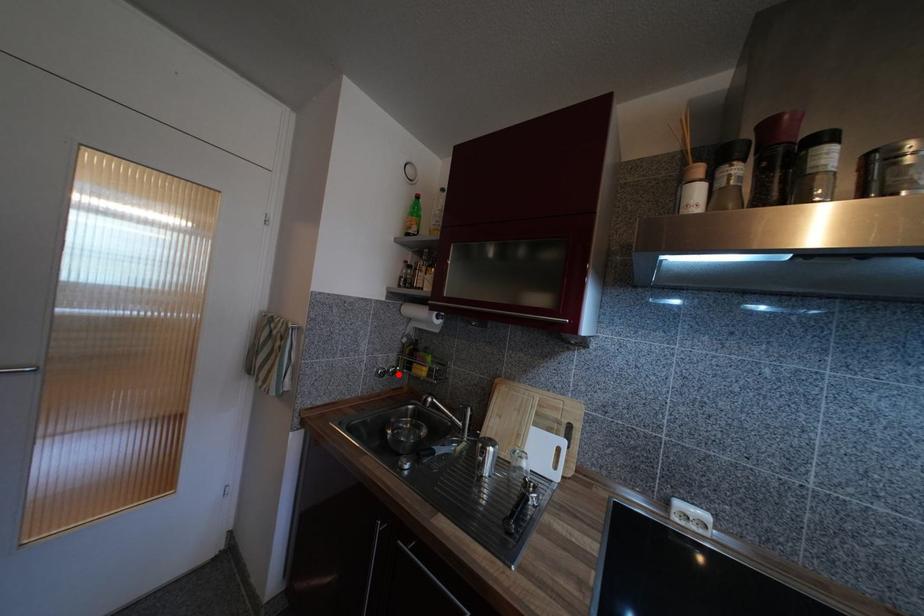
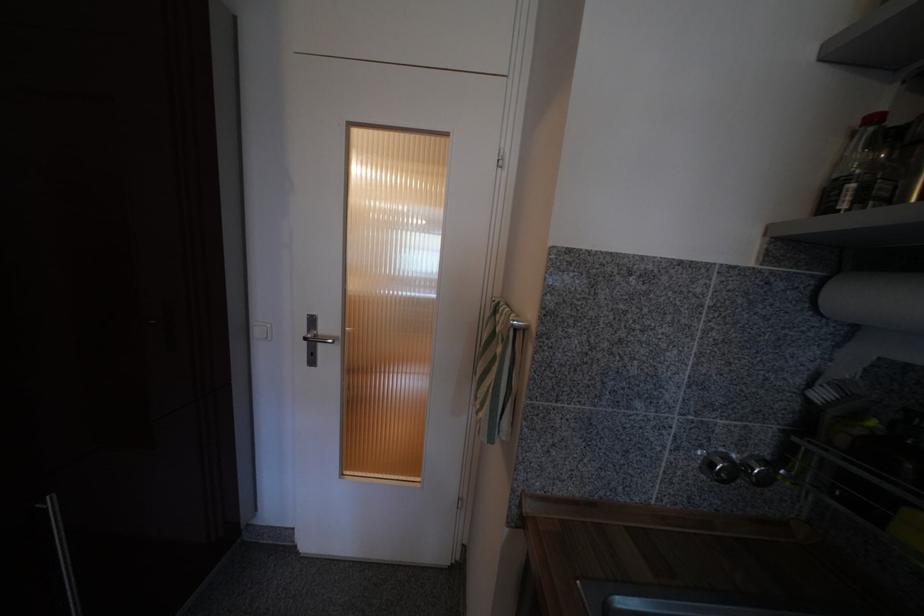
In the second image, find the point that corresponds to the highlighted location in the first image.

(772, 482)